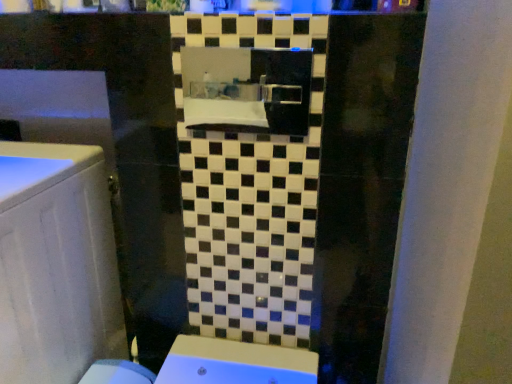
Question: Do you think satin black mirror at center is within white glossy cabinet at left, or outside of it?

Choices:
 (A) outside
 (B) inside

Answer: (A)

Question: Visually, is satin black mirror at center positioned to the left or to the right of white glossy cabinet at left?

Choices:
 (A) left
 (B) right

Answer: (B)

Question: From a real-world perspective, is satin black mirror at center physically located above or below white glossy cabinet at left?

Choices:
 (A) above
 (B) below

Answer: (A)

Question: Is point tap(87, 299) positioned closer to the camera than point tap(269, 130)?

Choices:
 (A) closer
 (B) farther

Answer: (B)

Question: Do you think white glossy cabinet at left is within satin black mirror at center, or outside of it?

Choices:
 (A) outside
 (B) inside

Answer: (A)

Question: Considering their positions, is white glossy cabinet at left located in front of or behind satin black mirror at center?

Choices:
 (A) front
 (B) behind

Answer: (A)

Question: From a real-world perspective, is white glossy cabinet at left above or below satin black mirror at center?

Choices:
 (A) above
 (B) below

Answer: (B)